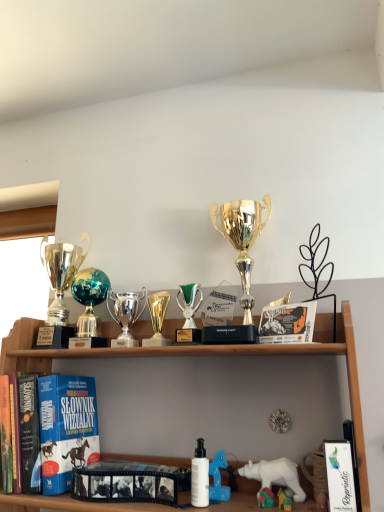
Question: Is black matte film strip at center, which is the second book from left to right, turned away from shiny silver trophy at left, placed as the 1th trophy when sorted from left to right?

Choices:
 (A) no
 (B) yes

Answer: (A)

Question: Considering the relative sizes of black matte film strip at center, which is the second book from left to right, and shiny silver trophy at left, which is counted as the second trophy, starting from the right, in the image provided, is black matte film strip at center, which is the second book from left to right, wider than shiny silver trophy at left, which is counted as the second trophy, starting from the right,?

Choices:
 (A) no
 (B) yes

Answer: (A)

Question: From a real-world perspective, is black matte film strip at center, placed as the 2th book when sorted from right to left, under shiny silver trophy at left, placed as the 1th trophy when sorted from left to right?

Choices:
 (A) yes
 (B) no

Answer: (A)

Question: Is black matte film strip at center, placed as the 2th book when sorted from right to left, with shiny silver trophy at left, placed as the 1th trophy when sorted from left to right?

Choices:
 (A) yes
 (B) no

Answer: (B)

Question: Does black matte film strip at center, which is the second book from left to right, appear on the right side of shiny silver trophy at left, placed as the 1th trophy when sorted from left to right?

Choices:
 (A) no
 (B) yes

Answer: (B)

Question: Is black matte film strip at center, placed as the 2th book when sorted from right to left, shorter than shiny silver trophy at left, placed as the 1th trophy when sorted from left to right?

Choices:
 (A) no
 (B) yes

Answer: (B)

Question: Is black matte film strip at center, which is the 2th book from back to front, inside shiny silver trophy at left, which is counted as the second trophy, starting from the right?

Choices:
 (A) no
 (B) yes

Answer: (A)

Question: From a real-world perspective, does shiny silver trophy at left, which is counted as the second trophy, starting from the right, sit lower than black matte film strip at center, placed as the 2th book when sorted from right to left?

Choices:
 (A) no
 (B) yes

Answer: (A)

Question: From a real-world perspective, is shiny silver trophy at left, placed as the 1th trophy when sorted from left to right, on black matte film strip at center, which is the second book from left to right?

Choices:
 (A) yes
 (B) no

Answer: (A)

Question: Considering the relative positions of shiny silver trophy at left, placed as the 1th trophy when sorted from left to right, and black matte film strip at center, which is the second book from left to right, in the image provided, is shiny silver trophy at left, placed as the 1th trophy when sorted from left to right, to the left of black matte film strip at center, which is the second book from left to right, from the viewer's perspective?

Choices:
 (A) yes
 (B) no

Answer: (A)

Question: Is shiny silver trophy at left, placed as the 1th trophy when sorted from left to right, facing away from black matte film strip at center, placed as the 2th book when sorted from right to left?

Choices:
 (A) no
 (B) yes

Answer: (A)

Question: From the image's perspective, does shiny silver trophy at left, which is counted as the second trophy, starting from the right, appear lower than black matte film strip at center, which appears as the second book when viewed from the front?

Choices:
 (A) yes
 (B) no

Answer: (B)

Question: Are white matte bottle at center and green metallic trophy at center, which is the second toy from right to left, beside each other?

Choices:
 (A) no
 (B) yes

Answer: (A)